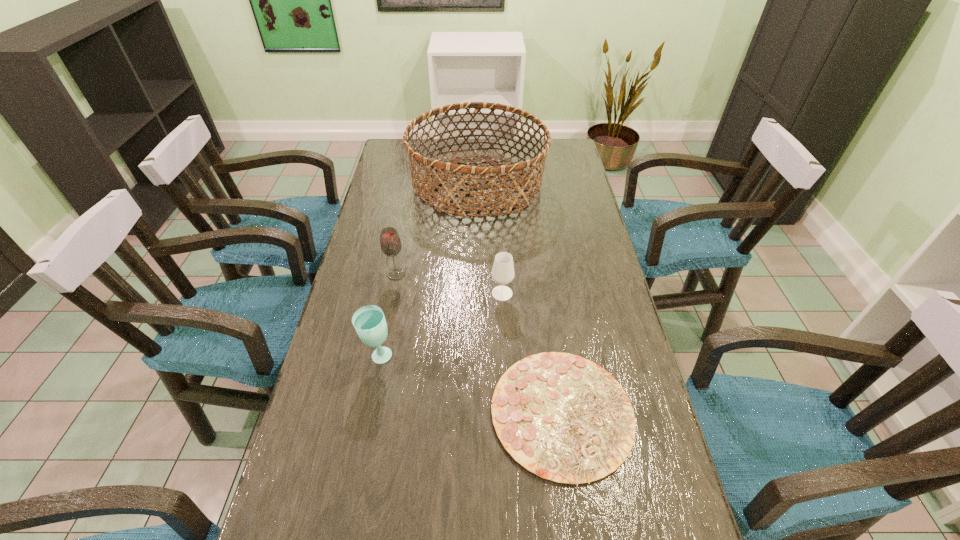
Find the location of a particular element. Image resolution: width=960 pixels, height=540 pixels. the farthest object is located at coordinates (444, 168).

You are a GUI agent. You are given a task and a screenshot of the screen. Output one action in this format:
    pyautogui.click(x=<x>, y=<y>)
    Task: Click on the tallest object
    This screenshot has height=540, width=960.
    Given the screenshot: What is the action you would take?
    pyautogui.click(x=444, y=168)

The width and height of the screenshot is (960, 540). I want to click on the farthest glass, so click(390, 242).

The width and height of the screenshot is (960, 540). In order to click on the nearest glass in this screenshot , I will do `click(369, 321)`.

Identify the location of the rightmost glass. This screenshot has width=960, height=540. (503, 273).

Locate an element on the screen. The image size is (960, 540). the second farthest glass is located at coordinates pos(503,273).

You are a GUI agent. You are given a task and a screenshot of the screen. Output one action in this format:
    pyautogui.click(x=<x>, y=<y>)
    Task: Click on the pizza
    
    Given the screenshot: What is the action you would take?
    pyautogui.click(x=564, y=418)

Locate an element on the screen. vacant space located on the back of the fourth nearest object is located at coordinates (405, 227).

Identify the location of vacant space situated on the right of the nearest glass. The image size is (960, 540). (488, 357).

Locate an element on the screen. The image size is (960, 540). vacant region located on the back of the third farthest object is located at coordinates (500, 258).